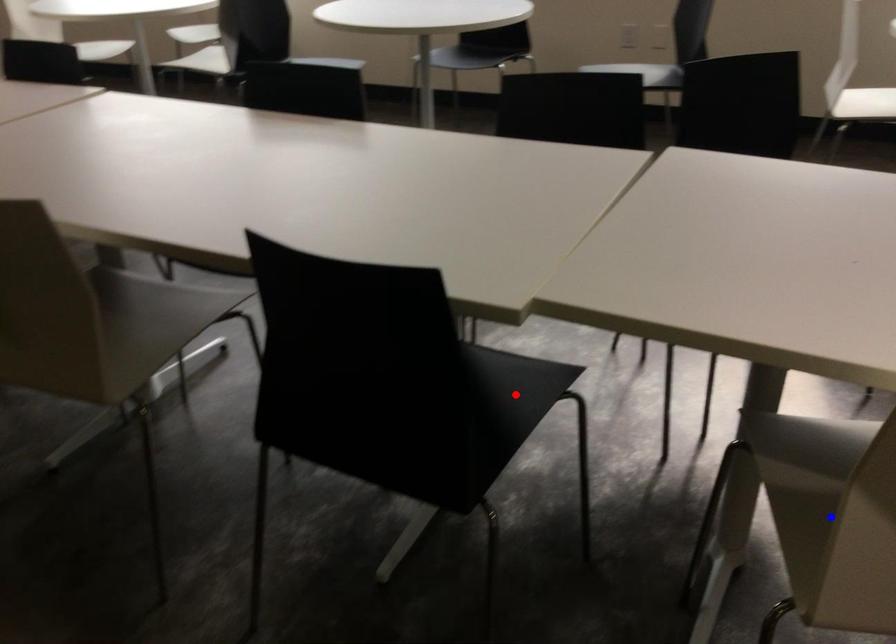
Question: Which of the two points in the image is closer to the camera?

Choices:
 (A) Blue point is closer.
 (B) Red point is closer.

Answer: (A)